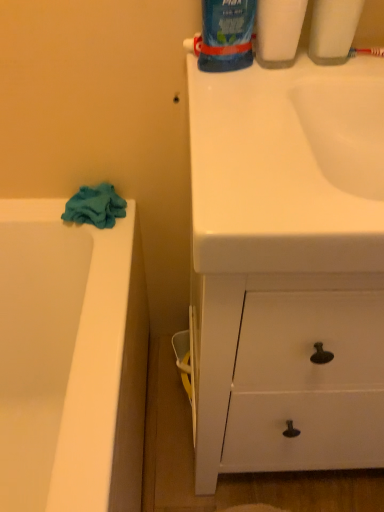
Locate an element on the screen. The width and height of the screenshot is (384, 512). free space in front of blue glossy bottle at upper center, placed as the second cleaning product when sorted from right to left is located at coordinates (256, 98).